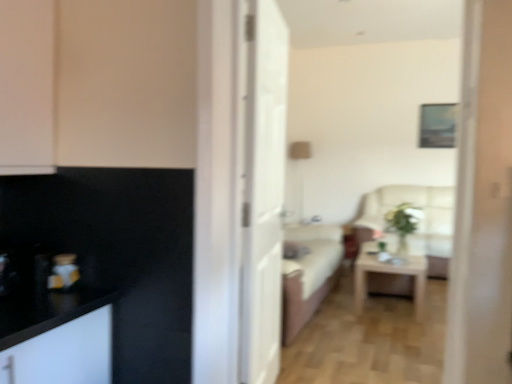
Question: Is metallic gold vase at left not inside beige fabric armchair at center?

Choices:
 (A) yes
 (B) no

Answer: (A)

Question: From a real-world perspective, does metallic gold vase at left stand above beige fabric armchair at center?

Choices:
 (A) yes
 (B) no

Answer: (A)

Question: From the image's perspective, is metallic gold vase at left located above beige fabric armchair at center?

Choices:
 (A) no
 (B) yes

Answer: (B)

Question: Can beige fabric armchair at center be found inside metallic gold vase at left?

Choices:
 (A) yes
 (B) no

Answer: (B)

Question: Does metallic gold vase at left come behind beige fabric armchair at center?

Choices:
 (A) yes
 (B) no

Answer: (B)

Question: Considering the positions of metallic gold vase at left and white glossy door at center in the image, is metallic gold vase at left wider or thinner than white glossy door at center?

Choices:
 (A) thin
 (B) wide

Answer: (A)

Question: In the image, is metallic gold vase at left on the left side or the right side of white glossy door at center?

Choices:
 (A) right
 (B) left

Answer: (B)

Question: Which is correct: metallic gold vase at left is inside white glossy door at center, or outside of it?

Choices:
 (A) inside
 (B) outside

Answer: (B)

Question: In terms of height, does metallic gold vase at left look taller or shorter compared to white glossy door at center?

Choices:
 (A) short
 (B) tall

Answer: (A)

Question: From a real-world perspective, is black matte cabinet at upper left above or below metallic gold vase at left?

Choices:
 (A) above
 (B) below

Answer: (A)

Question: Considering the positions of black matte cabinet at upper left and metallic gold vase at left in the image, is black matte cabinet at upper left taller or shorter than metallic gold vase at left?

Choices:
 (A) tall
 (B) short

Answer: (A)

Question: From the image's perspective, is black matte cabinet at upper left above or below metallic gold vase at left?

Choices:
 (A) above
 (B) below

Answer: (A)

Question: Considering the positions of black matte cabinet at upper left and metallic gold vase at left in the image, is black matte cabinet at upper left wider or thinner than metallic gold vase at left?

Choices:
 (A) wide
 (B) thin

Answer: (A)

Question: From a real-world perspective, is metallic gold vase at left above or below beige fabric armchair at center?

Choices:
 (A) above
 (B) below

Answer: (A)

Question: Choose the correct answer: Is metallic gold vase at left inside beige fabric armchair at center or outside it?

Choices:
 (A) inside
 (B) outside

Answer: (B)